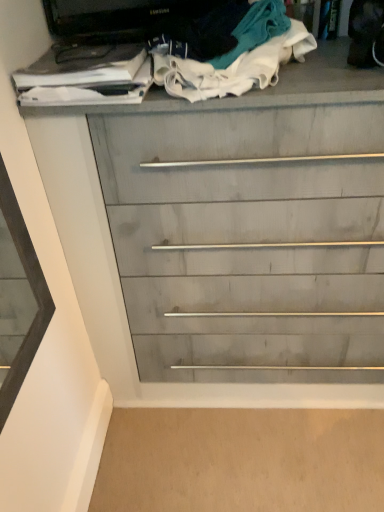
Question: From the image's perspective, is gray wood chest of drawers at center positioned above or below white cotton cloth at upper center, arranged as the 2th clothing when viewed from the left?

Choices:
 (A) above
 (B) below

Answer: (B)

Question: In terms of width, does gray wood chest of drawers at center look wider or thinner when compared to white cotton cloth at upper center, arranged as the 2th clothing when viewed from the left?

Choices:
 (A) thin
 (B) wide

Answer: (B)

Question: Based on their relative distances, which object is farther from the white cotton socks at upper center, which is counted as the 2th clothing, starting from the right?

Choices:
 (A) gray wood chest of drawers at center
 (B) white cotton cloth at upper center, arranged as the 2th clothing when viewed from the left

Answer: (A)

Question: Based on their relative distances, which object is nearer to the white cotton cloth at upper center, the first clothing in the right-to-left sequence?

Choices:
 (A) gray wood chest of drawers at center
 (B) white cotton socks at upper center, which is counted as the 2th clothing, starting from the right

Answer: (B)